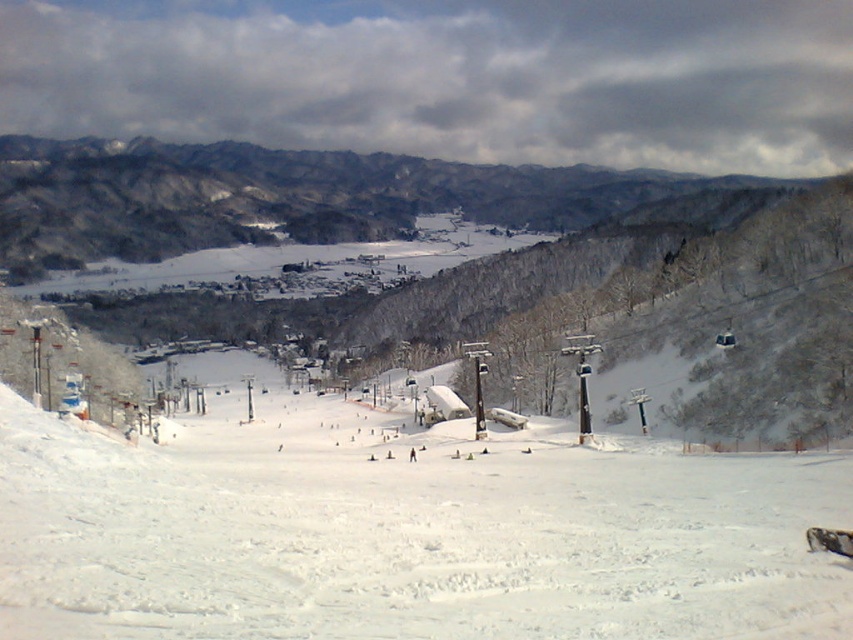
You are a skier planning to descend the slope. The resort has a rule that you must stay within the marked boundaries of the slope. Given that the white snow ski slope at center is represented by point (405, 541), can you confirm if your path will stay within the slope?

The white snow ski slope at center is represented by point (405, 541), so yes, staying on that point ensures you are within the slope boundaries.

You are a skier preparing to descend the slope. You notice the white snow ski slope at center and the white matte ski at center. Which object is closer to your current position?

The white matte ski at center is closer to your current position because the white snow ski slope at center is positioned under it.